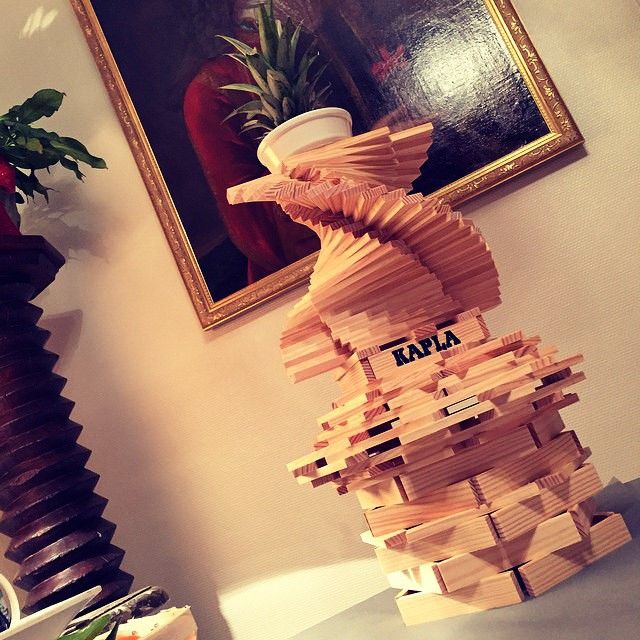
Where is `wooden plant pot stand`? wooden plant pot stand is located at coordinates (41, 468).